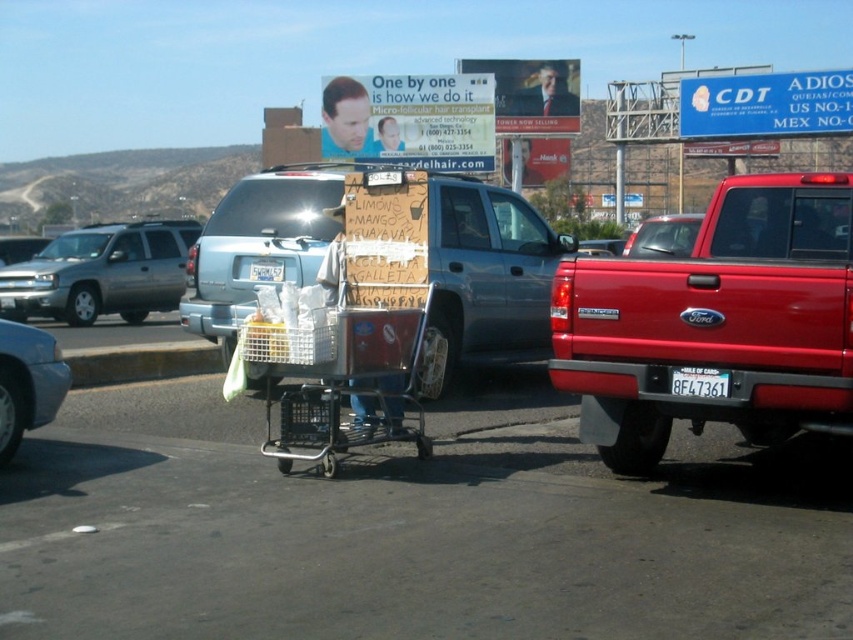
You are a pedestrian standing on the sidewalk and see the shiny red pickup truck at right and the metallic silver cart at center. Which object is nearer to you?

The shiny red pickup truck at right is closer to the viewer than the metallic silver cart at center, so the shiny red pickup truck at right is nearer to you.

You are a delivery person who needs to park your car between the shiny red pickup truck at right and the white plastic license plate at center. Can your car fit in the space between them?

The shiny red pickup truck at right is wider than the white plastic license plate at center, so the space between them may be insufficient for your car to fit comfortably. It is recommended to look for another parking spot.